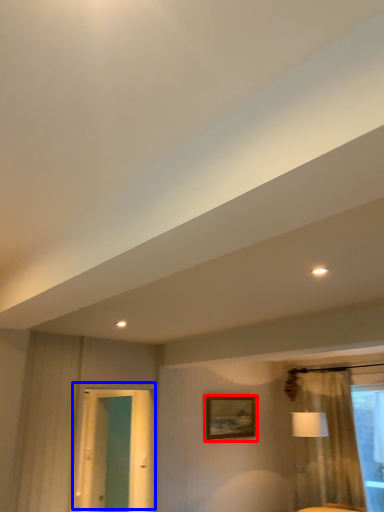
Question: Which object is further to the camera taking this photo, picture frame (highlighted by a red box) or door (highlighted by a blue box)?

Choices:
 (A) picture frame
 (B) door

Answer: (A)